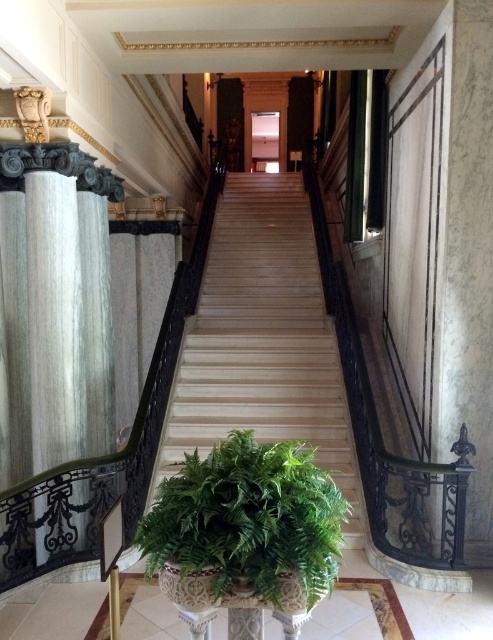
Question: Among these objects, which one is nearest to the camera?

Choices:
 (A) wooden stairs at center
 (B) green leafy plant at lower center

Answer: (B)

Question: In this image, where is wooden stairs at center located relative to green leafy plant at lower center?

Choices:
 (A) right
 (B) left

Answer: (B)

Question: Which point is farther from the camera taking this photo?

Choices:
 (A) (280, 280)
 (B) (206, 483)

Answer: (A)

Question: Does wooden stairs at center appear under green leafy plant at lower center?

Choices:
 (A) yes
 (B) no

Answer: (B)

Question: Considering the relative positions of wooden stairs at center and green leafy plant at lower center in the image provided, where is wooden stairs at center located with respect to green leafy plant at lower center?

Choices:
 (A) right
 (B) left

Answer: (B)